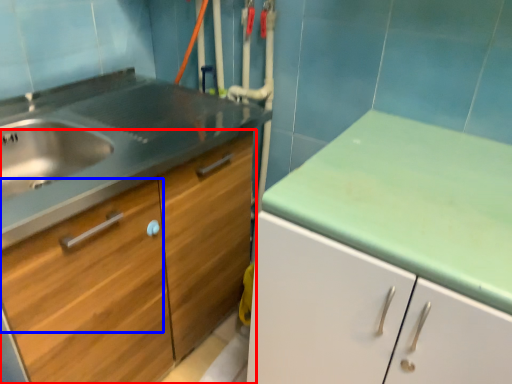
Question: Which of the following is the farthest to the observer, cabinetry (highlighted by a red box) or drawer (highlighted by a blue box)?

Choices:
 (A) cabinetry
 (B) drawer

Answer: (A)